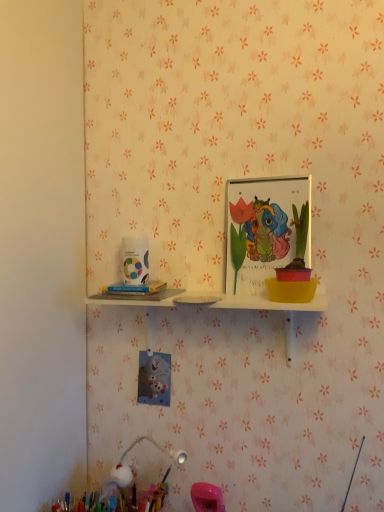
Question: Is pastel fluffy pom-pom at lower left oriented towards white paper at left?

Choices:
 (A) no
 (B) yes

Answer: (A)

Question: From a real-world perspective, does pastel fluffy pom-pom at lower left stand above white paper at left?

Choices:
 (A) no
 (B) yes

Answer: (A)

Question: Is pastel fluffy pom-pom at lower left far away from white paper at left?

Choices:
 (A) no
 (B) yes

Answer: (A)

Question: Can you confirm if pastel fluffy pom-pom at lower left is positioned to the left of white paper at left?

Choices:
 (A) yes
 (B) no

Answer: (A)

Question: Is pastel fluffy pom-pom at lower left bigger than white paper at left?

Choices:
 (A) no
 (B) yes

Answer: (B)

Question: Does pastel fluffy pom-pom at lower left have a lesser width compared to white paper at left?

Choices:
 (A) no
 (B) yes

Answer: (A)

Question: From the image's perspective, is matte plastic picture frame at upper center above white paper at left?

Choices:
 (A) yes
 (B) no

Answer: (A)

Question: From a real-world perspective, is matte plastic picture frame at upper center beneath white paper at left?

Choices:
 (A) yes
 (B) no

Answer: (B)

Question: Is matte plastic picture frame at upper center looking in the opposite direction of white paper at left?

Choices:
 (A) no
 (B) yes

Answer: (A)

Question: Are matte plastic picture frame at upper center and white paper at left beside each other?

Choices:
 (A) no
 (B) yes

Answer: (A)

Question: Is matte plastic picture frame at upper center behind white paper at left?

Choices:
 (A) yes
 (B) no

Answer: (B)

Question: Can white paper at left be found inside matte plastic picture frame at upper center?

Choices:
 (A) yes
 (B) no

Answer: (B)

Question: Is white paper at left oriented towards pastel fluffy pom-pom at lower left?

Choices:
 (A) no
 (B) yes

Answer: (A)